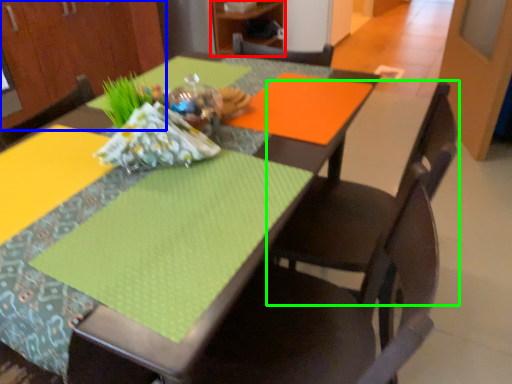
Question: Which object is positioned farthest from cabinetry (highlighted by a red box)? Select from cabinetry (highlighted by a blue box) and chair (highlighted by a green box).

Choices:
 (A) cabinetry
 (B) chair

Answer: (B)